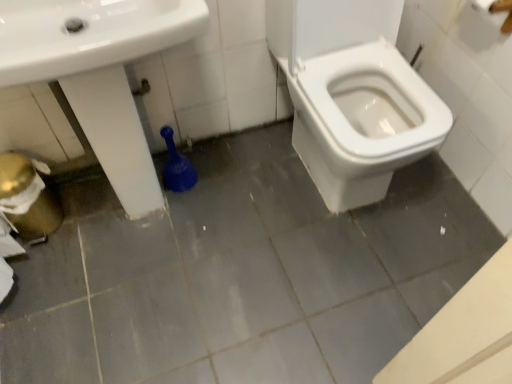
Identify the location of free area in between white glossy toilet at center and white glossy sink at lower left. (247, 195).